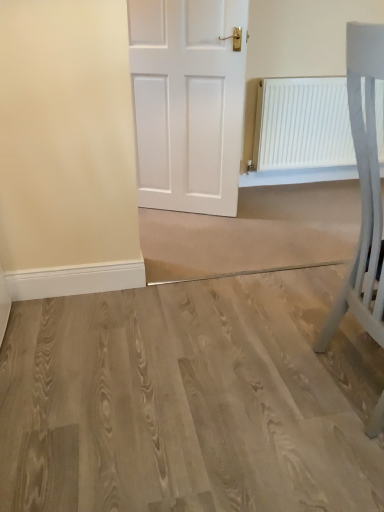
Locate an element on the screen. This screenshot has height=512, width=384. white matte radiator at upper right is located at coordinates pyautogui.click(x=302, y=124).

Where is `light wood floor at center`? Image resolution: width=384 pixels, height=512 pixels. light wood floor at center is located at coordinates (190, 400).

Identify the location of white matte radiator at upper right. (302, 124).

What are the coordinates of `furniture above the white matte radiator at upper right (from a real-world perspective)` in the screenshot? It's located at (363, 188).

Looking at this image, in terms of height, does white matte chair at right look taller or shorter compared to white matte radiator at upper right?

Considering their sizes, white matte chair at right has more height than white matte radiator at upper right.

Is point (381, 223) closer to camera compared to point (339, 159)?

Yes, point (381, 223) is closer to viewer.

Which of these two, white matte chair at right or white matte radiator at upper right, is smaller?

With smaller size is white matte radiator at upper right.

Could you tell me if white matte radiator at upper right is turned towards white matte chair at right?

Yes.

Is the position of white matte radiator at upper right less distant than that of white matte chair at right?

No, white matte radiator at upper right is further to the viewer.

Does white matte radiator at upper right have a larger size compared to white matte chair at right?

Actually, white matte radiator at upper right might be smaller than white matte chair at right.

From a real-world perspective, is white matte radiator at upper right positioned above or below light wood floor at center?

In terms of real-world spatial position, white matte radiator at upper right is above light wood floor at center.

What's the angular difference between white matte radiator at upper right and light wood floor at center's facing directions?

88.3 degrees separate the facing orientations of white matte radiator at upper right and light wood floor at center.

Considering the sizes of objects white matte radiator at upper right and light wood floor at center in the image provided, who is bigger, white matte radiator at upper right or light wood floor at center?

With larger size is light wood floor at center.

Which of these two, white matte radiator at upper right or light wood floor at center, is thinner?

white matte radiator at upper right.

How much distance is there between light wood floor at center and white matte chair at right?

light wood floor at center and white matte chair at right are 22.52 inches apart from each other.

Is light wood floor at center placed right next to white matte chair at right?

No, light wood floor at center is not in contact with white matte chair at right.

Is light wood floor at center further to the viewer compared to white matte chair at right?

Yes, it is behind white matte chair at right.

From a real-world perspective, between light wood floor at center and white matte chair at right, who is vertically lower?

light wood floor at center.

Is light wood floor at center facing towards white matte radiator at upper right?

No.

Is light wood floor at center outside of white matte radiator at upper right?

That's correct, light wood floor at center is outside of white matte radiator at upper right.

Considering the relative sizes of light wood floor at center and white matte radiator at upper right in the image provided, is light wood floor at center bigger than white matte radiator at upper right?

Indeed, light wood floor at center has a larger size compared to white matte radiator at upper right.

Which is farther, (358, 258) or (211, 387)?

The point (211, 387) is behind.

Between white matte chair at right and light wood floor at center, which one has more height?

white matte chair at right is taller.

Based on the photo, considering the relative positions of white matte chair at right and light wood floor at center in the image provided, is white matte chair at right behind light wood floor at center?

No.

Is light wood floor at center completely or partially inside white matte chair at right?

No, white matte chair at right does not contain light wood floor at center.

Image resolution: width=384 pixels, height=512 pixels. In order to click on furniture in front of the white matte radiator at upper right in this screenshot , I will do `click(363, 188)`.

What are the coordinates of `furniture above the white matte radiator at upper right (from a real-world perspective)` in the screenshot? It's located at (363, 188).

Considering their positions, is white matte radiator at upper right positioned closer to light wood floor at center than white matte chair at right?

Based on the image, white matte chair at right appears to be nearer to light wood floor at center.

Based on the photo, when comparing their distances from white matte chair at right, does white matte radiator at upper right or light wood floor at center seem further?

The object further to white matte chair at right is white matte radiator at upper right.

Looking at the image, which one is located further to light wood floor at center, white matte chair at right or white matte radiator at upper right?

white matte radiator at upper right is positioned further to the anchor light wood floor at center.

Based on their spatial positions, is white matte chair at right or light wood floor at center further from white matte radiator at upper right?

light wood floor at center is further to white matte radiator at upper right.

Which object lies nearer to the anchor point white matte chair at right, light wood floor at center or white matte radiator at upper right?

light wood floor at center is positioned closer to the anchor white matte chair at right.

Estimate the real-world distances between objects in this image. Which object is further from white matte radiator at upper right, light wood floor at center or white matte chair at right?

Among the two, light wood floor at center is located further to white matte radiator at upper right.

This screenshot has height=512, width=384. Identify the location of plain between white matte chair at right and white matte radiator at upper right in the front-back direction. [x=190, y=400].